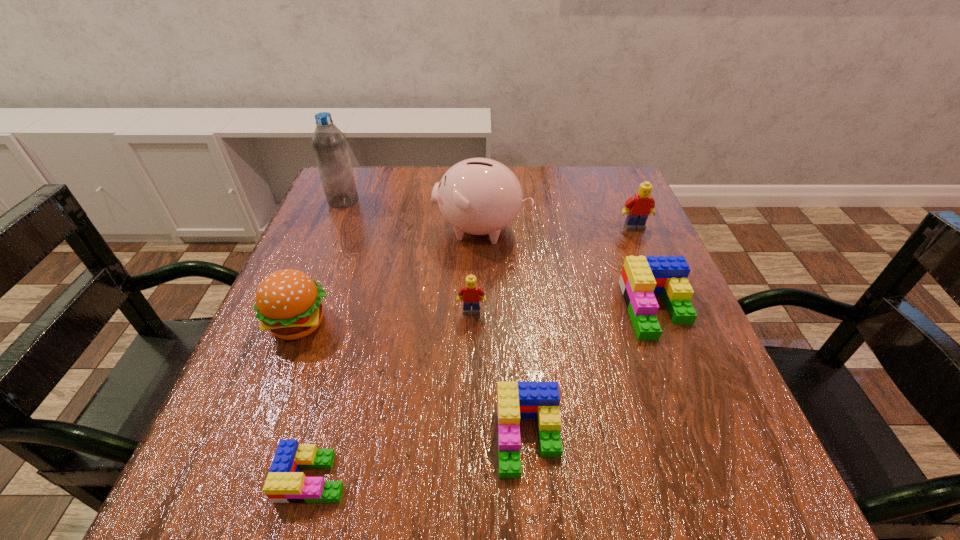
Image resolution: width=960 pixels, height=540 pixels. I want to click on the biggest green Lego, so click(x=642, y=278).

Where is `the seventh tallest object`? the seventh tallest object is located at coordinates (515, 400).

Where is `the second smallest green Lego`? the second smallest green Lego is located at coordinates (515, 400).

In order to click on the leftmost green Lego in this screenshot , I will do `click(285, 484)`.

This screenshot has height=540, width=960. I want to click on the shortest object, so click(285, 484).

The image size is (960, 540). Identify the location of free point located 0.340m on the right of the tallest object. (493, 200).

Identify the location of vacant region located on the right of the pink piggy bank. This screenshot has width=960, height=540. (612, 229).

This screenshot has height=540, width=960. Identify the location of blank space located 0.100m on the front-facing side of the bigger yellow Lego. (648, 259).

Locate an element on the screen. free point located on the right of the hamburger is located at coordinates click(538, 324).

Locate an element on the screen. vacant space situated 0.230m on the front-facing side of the fourth Lego from right to left is located at coordinates (469, 429).